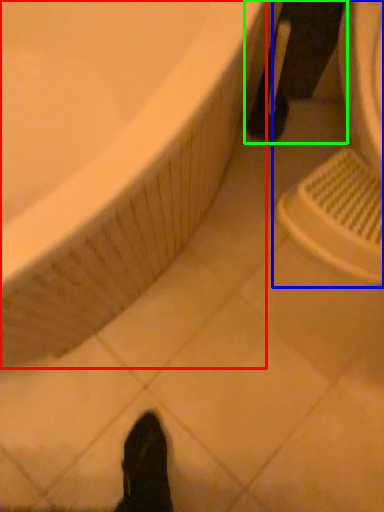
Question: Considering the real-world distances, which object is closest to bathtub (highlighted by a red box)? sink (highlighted by a blue box) or leg (highlighted by a green box).

Choices:
 (A) sink
 (B) leg

Answer: (A)